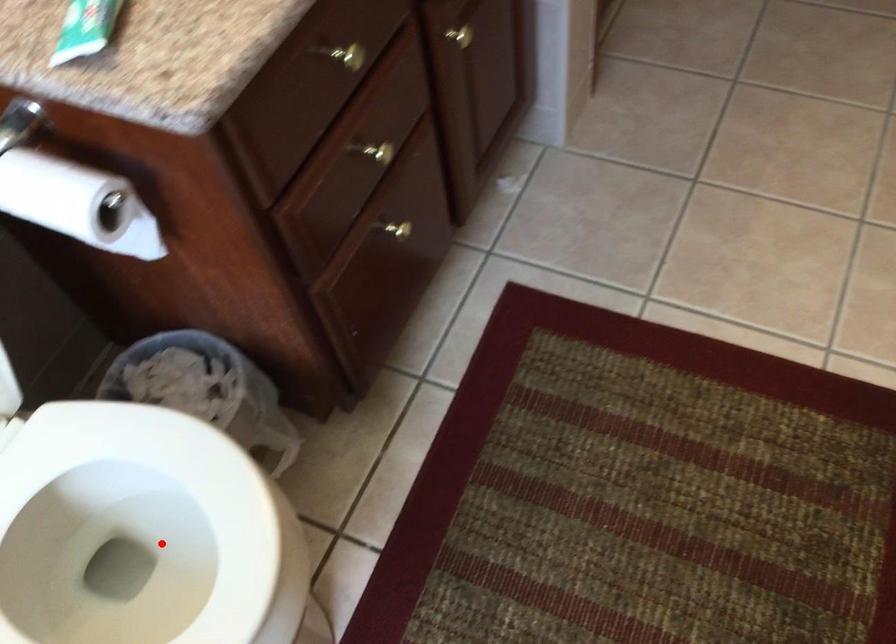
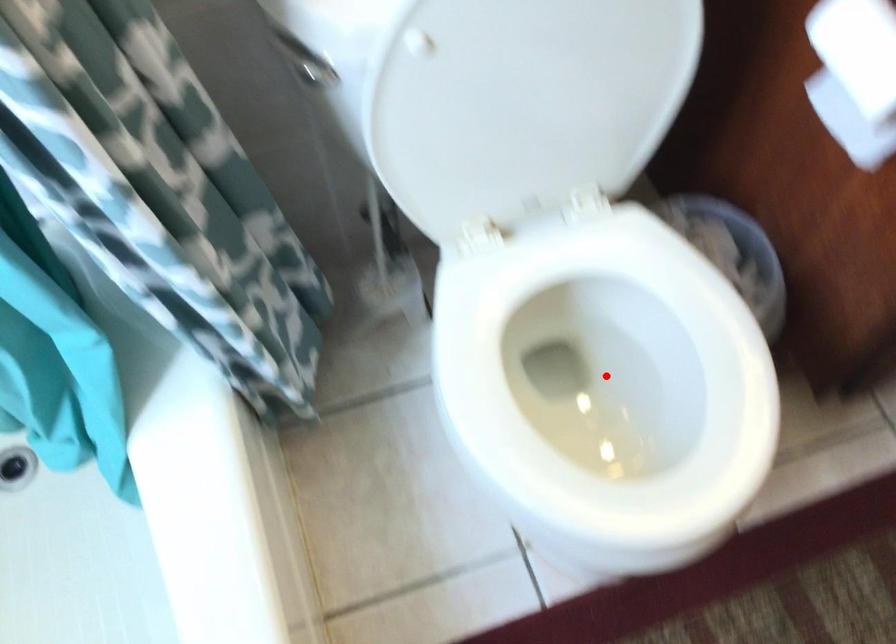
I am providing you with two images of the same scene from different viewpoints. A red point is marked on the first image and another point is marked on the second image. Does the point marked in image1 correspond to the same location as the one in image2?

Yes